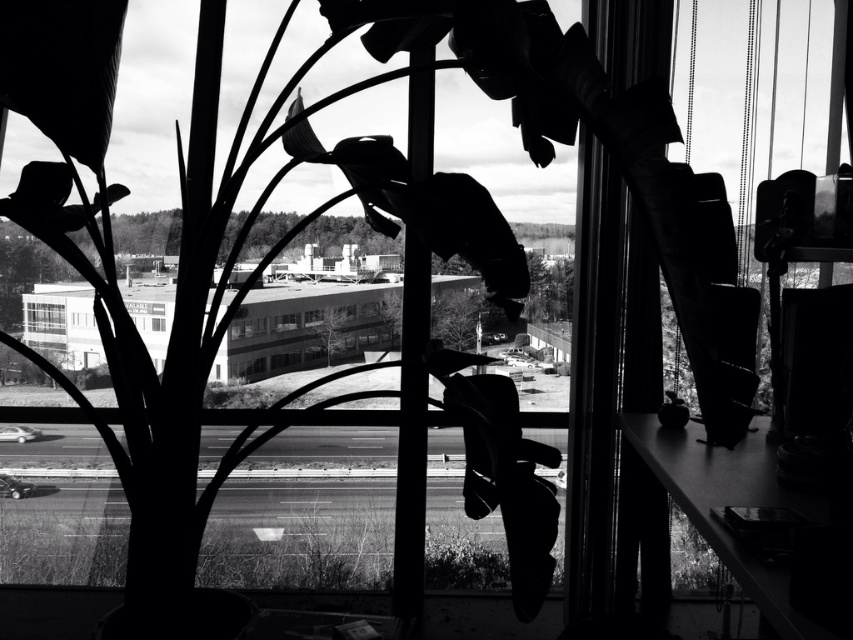
You are a window cleaner with a 5 meter long pole. You are standing at the camera position and want to clean the clear glass window at center. Can you reach the window with your pole?

The clear glass window at center is 5.09 meters away from the camera, so the 5 meter pole is slightly too short to reach it.

You are a delivery person holding a package that is 20 inches wide. You need to pass through the clear glass window at center and the transparent glass window at center to deliver it. Can you fit through the space between them?

The clear glass window at center and transparent glass window at center are 21.18 inches apart from each other. Since your package is 20 inches wide, you can fit through the space between them.